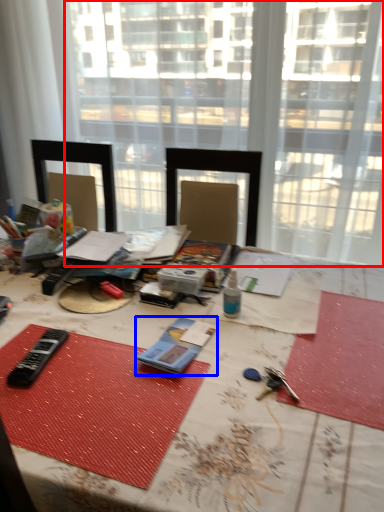
Question: Which object is further to the camera taking this photo, window (highlighted by a red box) or equipment (highlighted by a blue box)?

Choices:
 (A) window
 (B) equipment

Answer: (A)